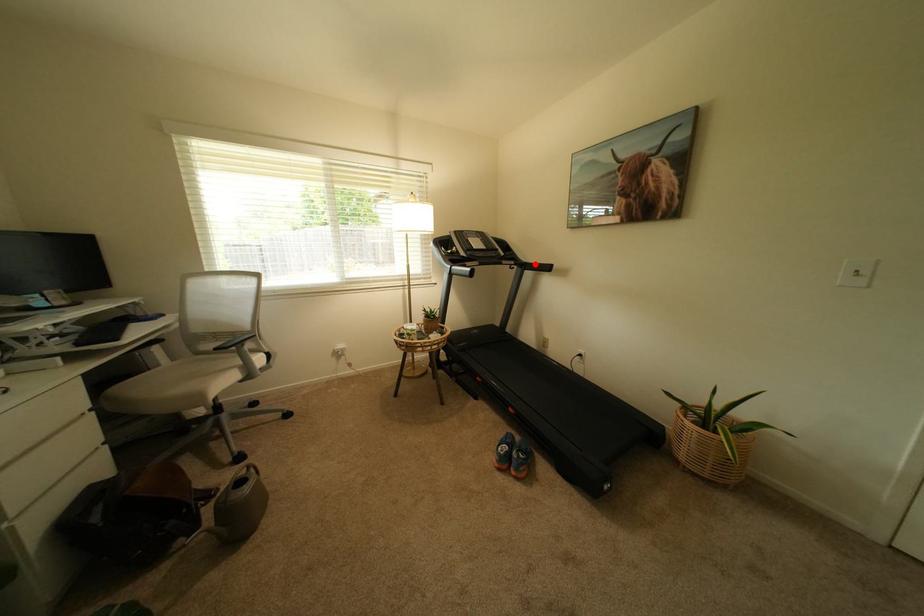
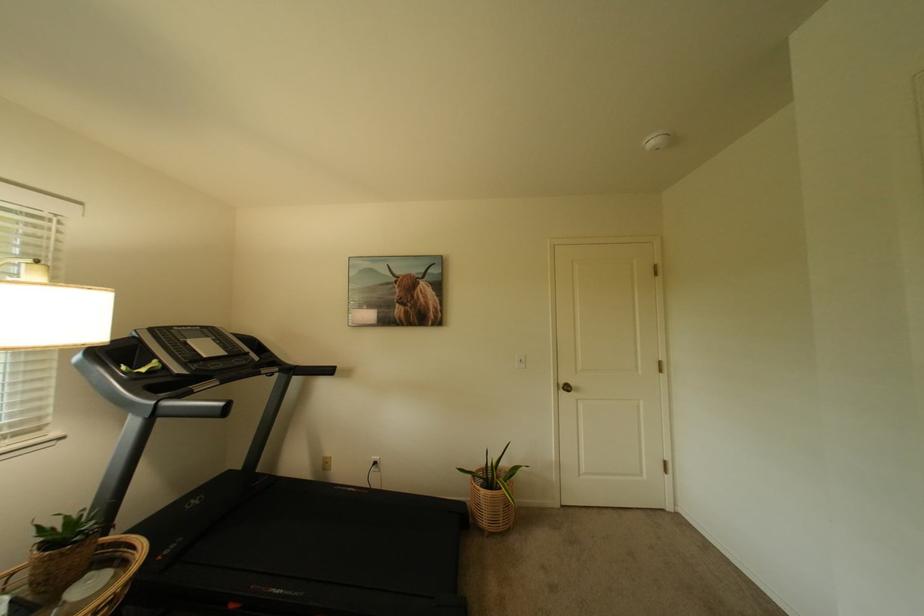
In the second image, find the point that corresponds to the highlighted location in the first image.

(305, 368)